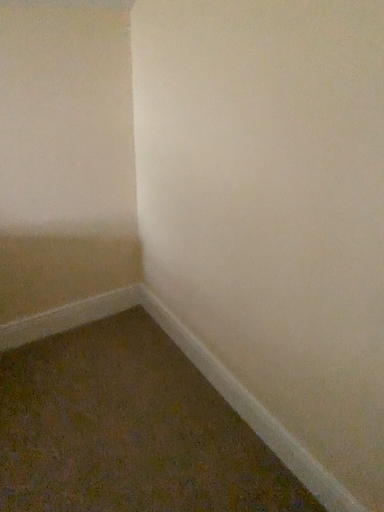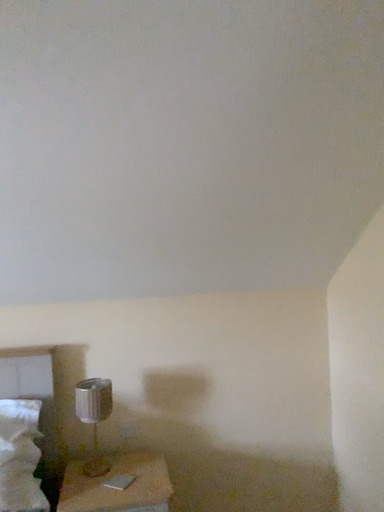
Question: How did the camera likely rotate when shooting the video?

Choices:
 (A) rotated right
 (B) rotated left

Answer: (B)